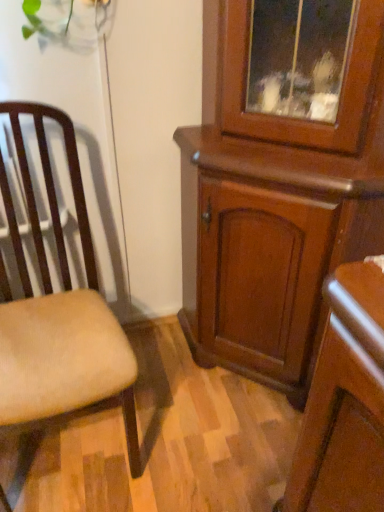
Question: Should I look upward or downward to see wooden cabinet at center?

Choices:
 (A) down
 (B) up

Answer: (B)

Question: Can you confirm if wooden cabinet at center is shorter than beige fabric chair at left?

Choices:
 (A) no
 (B) yes

Answer: (A)

Question: From a real-world perspective, is wooden cabinet at center positioned over beige fabric chair at left based on gravity?

Choices:
 (A) yes
 (B) no

Answer: (A)

Question: Is the position of wooden cabinet at center less distant than that of beige fabric chair at left?

Choices:
 (A) yes
 (B) no

Answer: (B)

Question: Can you confirm if wooden cabinet at center is thinner than beige fabric chair at left?

Choices:
 (A) yes
 (B) no

Answer: (A)

Question: From the image's perspective, does wooden cabinet at center appear lower than beige fabric chair at left?

Choices:
 (A) no
 (B) yes

Answer: (A)

Question: Is wooden cabinet at center wider than beige fabric chair at left?

Choices:
 (A) no
 (B) yes

Answer: (A)

Question: Is beige fabric chair at left next to wooden cabinet at center?

Choices:
 (A) yes
 (B) no

Answer: (B)

Question: Can you confirm if beige fabric chair at left is positioned to the right of wooden cabinet at center?

Choices:
 (A) yes
 (B) no

Answer: (B)

Question: Considering the relative sizes of beige fabric chair at left and wooden cabinet at center in the image provided, is beige fabric chair at left shorter than wooden cabinet at center?

Choices:
 (A) yes
 (B) no

Answer: (A)

Question: Does beige fabric chair at left have a smaller size compared to wooden cabinet at center?

Choices:
 (A) yes
 (B) no

Answer: (A)

Question: Is beige fabric chair at left thinner than wooden cabinet at center?

Choices:
 (A) yes
 (B) no

Answer: (B)

Question: Does beige fabric chair at left appear on the left side of wooden cabinet at center?

Choices:
 (A) yes
 (B) no

Answer: (A)

Question: Looking at their shapes, would you say wooden cabinet at center is wider or thinner than beige fabric chair at left?

Choices:
 (A) thin
 (B) wide

Answer: (A)